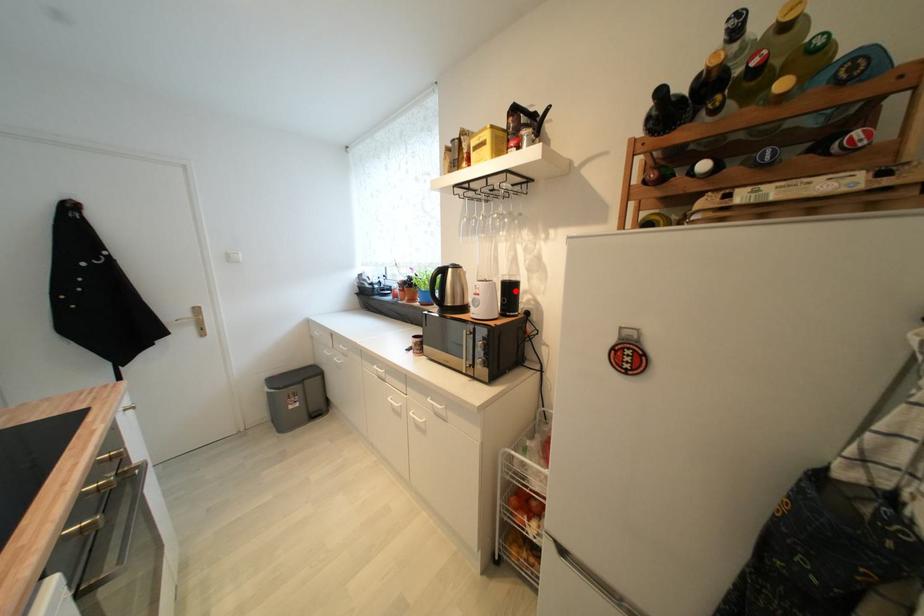
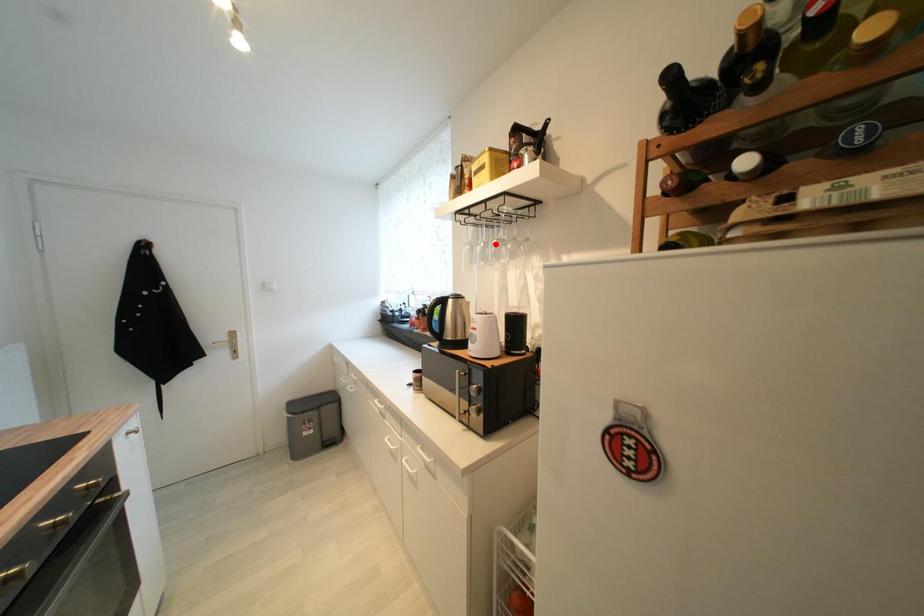
Based on the photo, I am providing you with two images of the same scene from different viewpoints. A red point is marked on the first image and another point is marked on the second image. Is the marked point in image1 the same physical position as the marked point in image2?

No